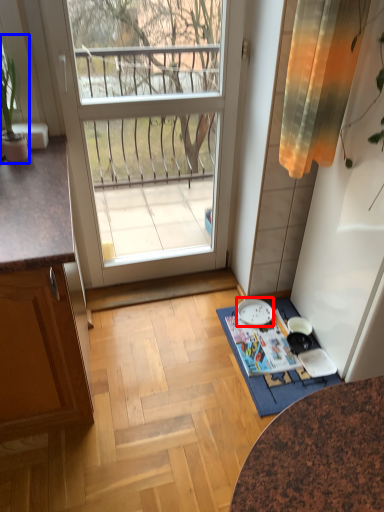
Question: Which of the following is the closest to the observer, plate (highlighted by a red box) or houseplant (highlighted by a blue box)?

Choices:
 (A) plate
 (B) houseplant

Answer: (B)